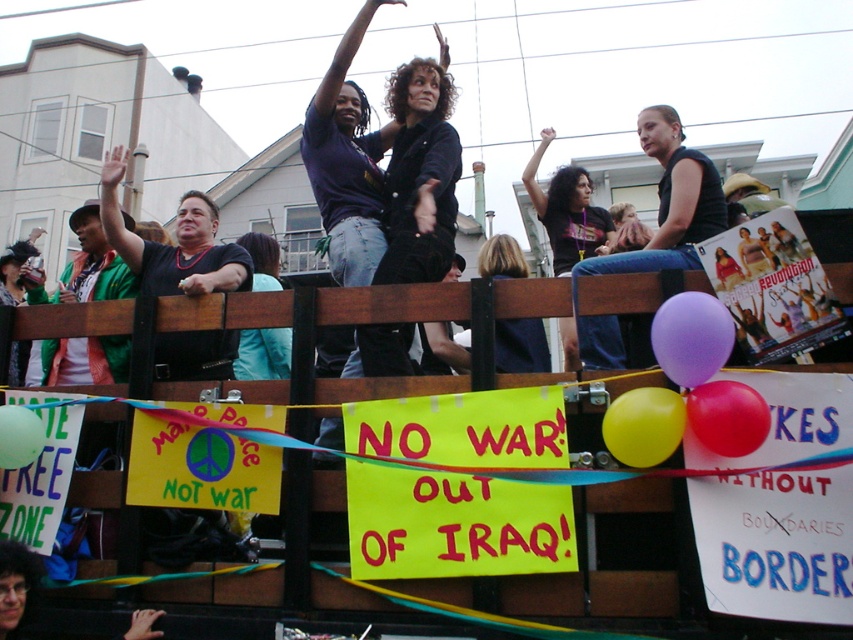
You are a photographer at the protest trying to capture the float. You notice the purple rubber balloon at upper center and the green rubber balloon at lower left. Which balloon is wider?

The purple rubber balloon at upper center is wider than the green rubber balloon at lower left.

You are a photographer taking pictures of the protest float. You notice the yellow rubber balloon at center and the green rubber balloon at lower left. Which balloon is directly above the other?

The yellow rubber balloon at center is positioned over the green rubber balloon at lower left, so it is directly above it.

You are a photographer standing at the front of the float. You want to capture a closeup shot of the purple rubber balloon at upper center without moving your position. Is it possible to do so with a standard camera lens that has a maximum zoom of 5 meters?

The purple rubber balloon at upper center is 7.73 meters away from the viewer. Since the camera lens can only zoom up to 5 meters, it cannot reach the required distance to capture a closeup without moving closer.